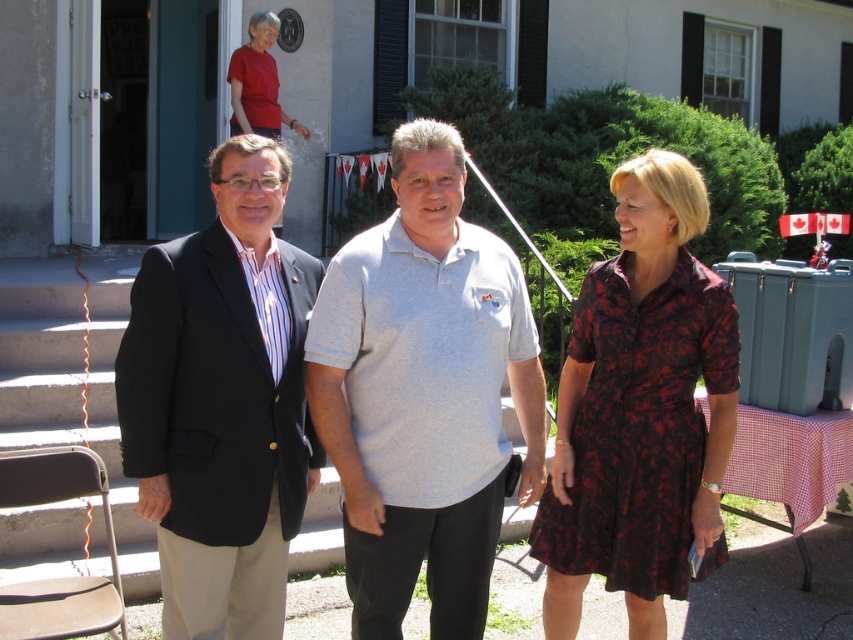
Question: Is matte gray shirt at center wider than matte red shirt at upper center?

Choices:
 (A) yes
 (B) no

Answer: (A)

Question: Which point is closer to the camera?

Choices:
 (A) (573, 465)
 (B) (341, 257)
 (C) (511, 289)
 (D) (289, 120)

Answer: (B)

Question: Which of the following is the farthest from the observer?

Choices:
 (A) (109, 394)
 (B) (436, 570)

Answer: (A)

Question: Which of the following is the closest to the observer?

Choices:
 (A) matte gray shirt at center
 (B) dark red floral dress at center

Answer: (A)

Question: Does matte gray shirt at center come behind matte red shirt at upper center?

Choices:
 (A) no
 (B) yes

Answer: (A)

Question: Is gray cotton polo shirt at center above matte black blazer at center?

Choices:
 (A) yes
 (B) no

Answer: (A)